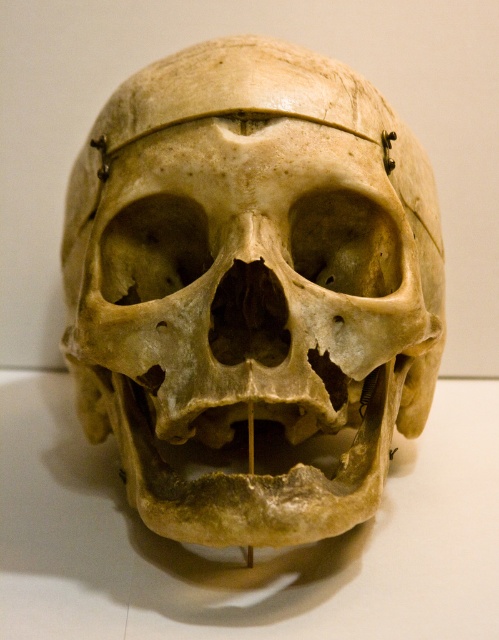
Does point (62, 339) come behind point (438, 472)?

Yes, point (62, 339) is farther from viewer.

Can you confirm if bone-like skull at center is positioned to the left of yellowish bone at center?

Incorrect, bone-like skull at center is not on the left side of yellowish bone at center.

At what (x,y) coordinates should I click in order to perform the action: click on bone-like skull at center. Please return your answer as a coordinate pair (x, y). The height and width of the screenshot is (640, 499). Looking at the image, I should click on (251, 284).

This screenshot has height=640, width=499. I want to click on bone-like skull at center, so click(251, 284).